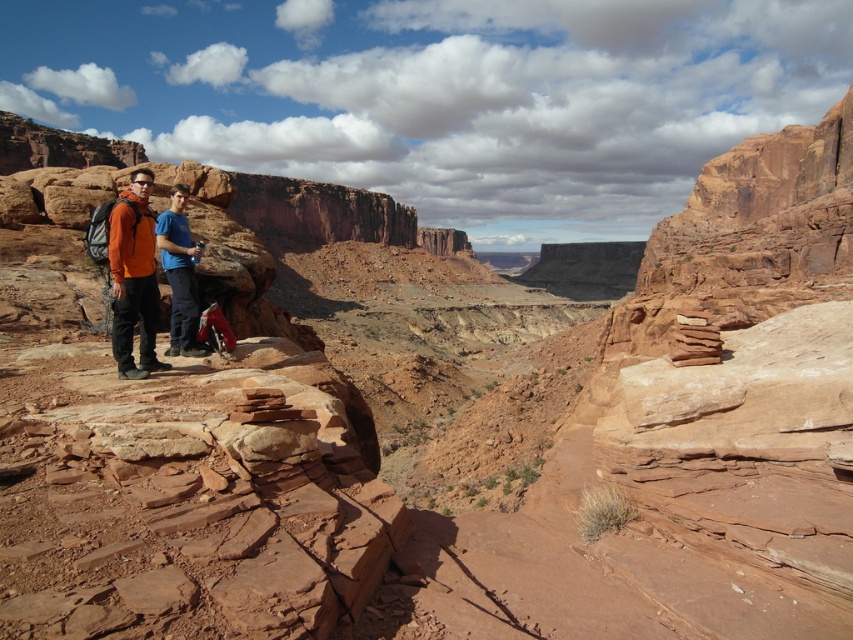
Which of these two, matte orange jacket at left or blue cotton shirt at center, stands taller?

Standing taller between the two is matte orange jacket at left.

Which is below, matte orange jacket at left or blue cotton shirt at center?

Positioned lower is blue cotton shirt at center.

Which is in front, point (137, 234) or point (184, 275)?

Point (137, 234) is in front.

You are a GUI agent. You are given a task and a screenshot of the screen. Output one action in this format:
    pyautogui.click(x=<x>, y=<y>)
    Task: Click on the matte orange jacket at left
    The width and height of the screenshot is (853, 640).
    Given the screenshot: What is the action you would take?
    pyautogui.click(x=134, y=276)